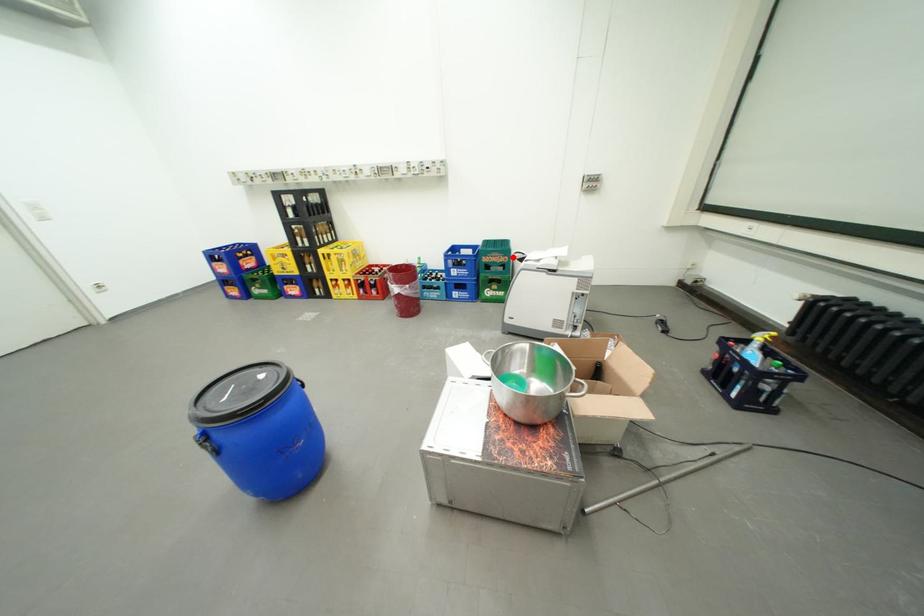
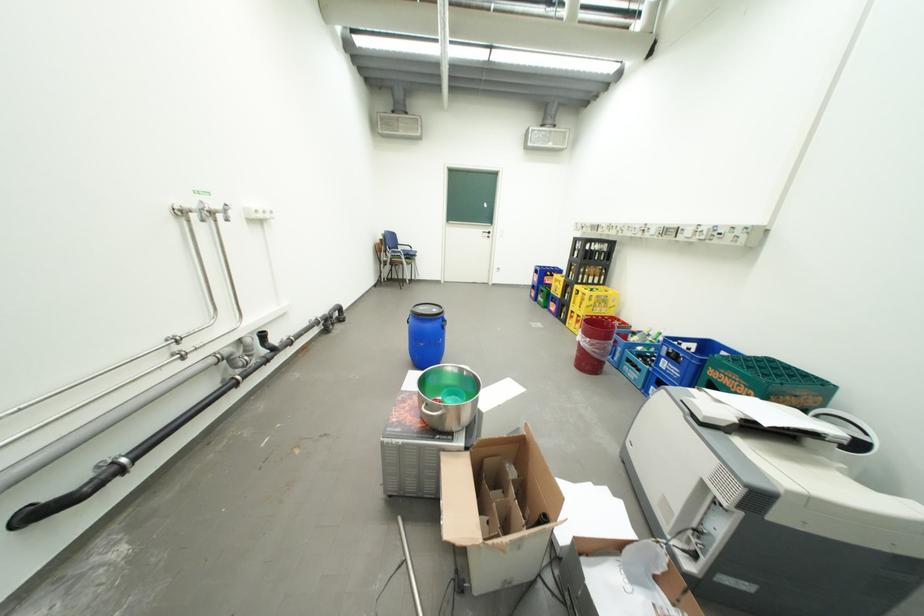
Question: I am providing you with two images of the same scene from different viewpoints. In image1, a red point is highlighted. Considering the same 3D point in image2, which of the following is correct?

Choices:
 (A) It is closer
 (B) It is farther

Answer: (B)